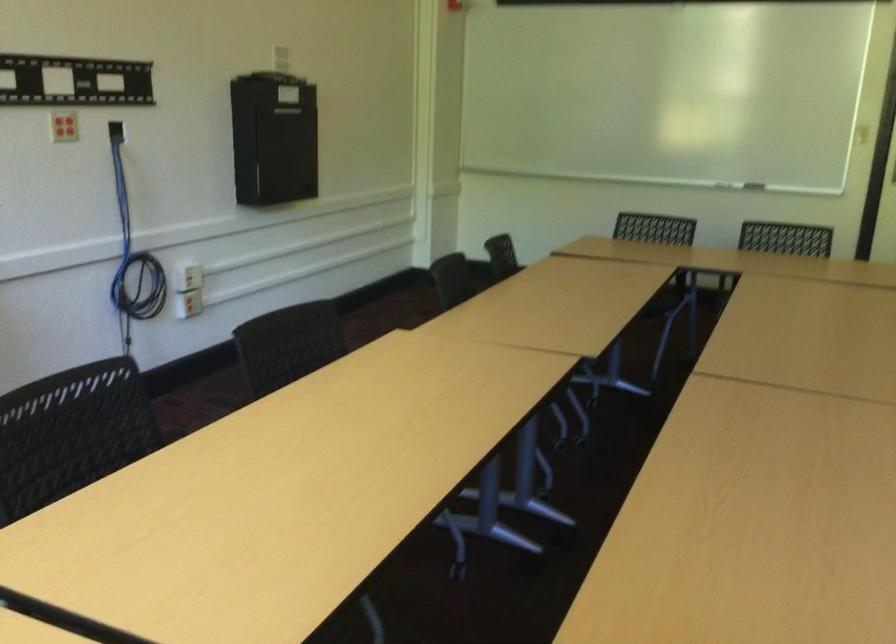
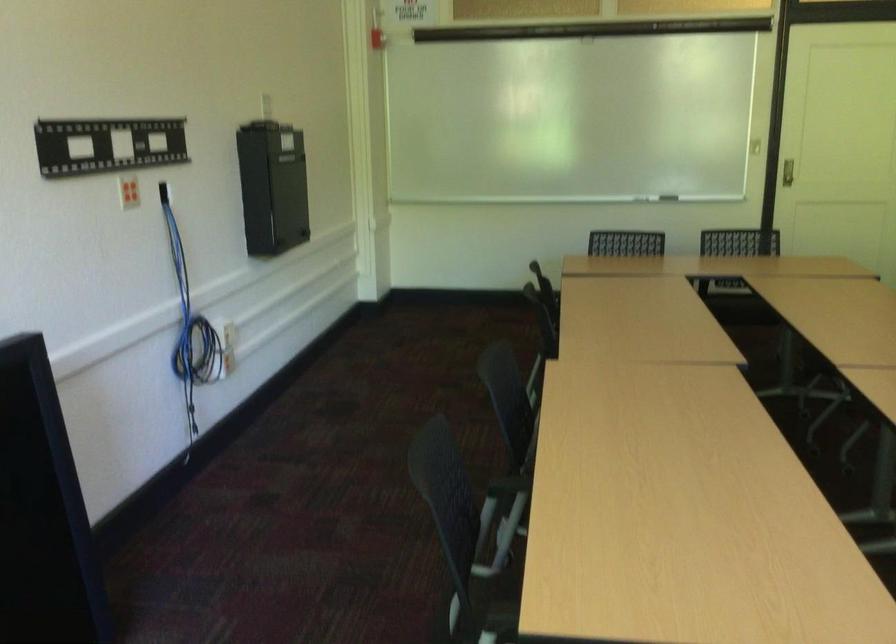
Find the pixel in the second image that matches the point at 737,190 in the first image.

(668, 198)